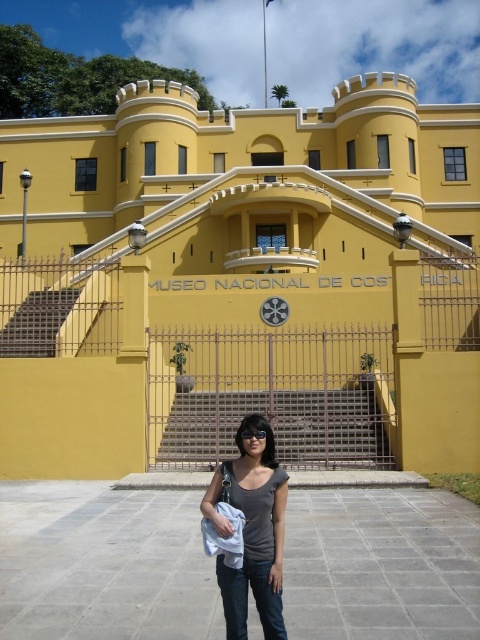
Question: Does yellow matte building at center have a smaller size compared to gray matte shirt at center?

Choices:
 (A) yes
 (B) no

Answer: (B)

Question: Which object is farther from the camera taking this photo?

Choices:
 (A) yellow matte building at center
 (B) gray matte shirt at center

Answer: (A)

Question: Can you confirm if yellow matte building at center is wider than gray matte shirt at center?

Choices:
 (A) yes
 (B) no

Answer: (A)

Question: Is yellow matte building at center to the right of gray matte shirt at center from the viewer's perspective?

Choices:
 (A) yes
 (B) no

Answer: (B)